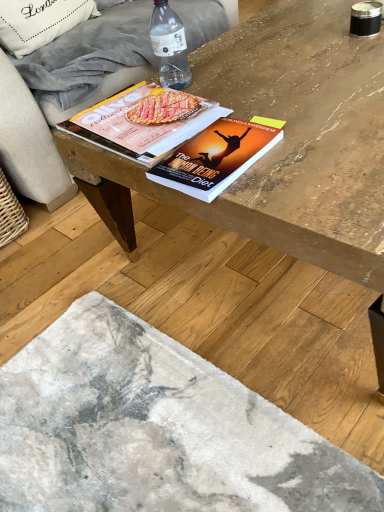
This screenshot has height=512, width=384. I want to click on vacant area that is in front of hardcover book at center, arranged as the 1th book when viewed from the front, so click(x=284, y=202).